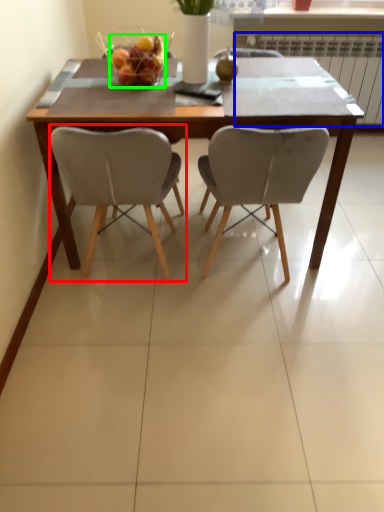
Question: Considering the real-world distances, which object is farthest from chair (highlighted by a red box)? radiator (highlighted by a blue box) or fruit dish (highlighted by a green box)?

Choices:
 (A) radiator
 (B) fruit dish

Answer: (A)